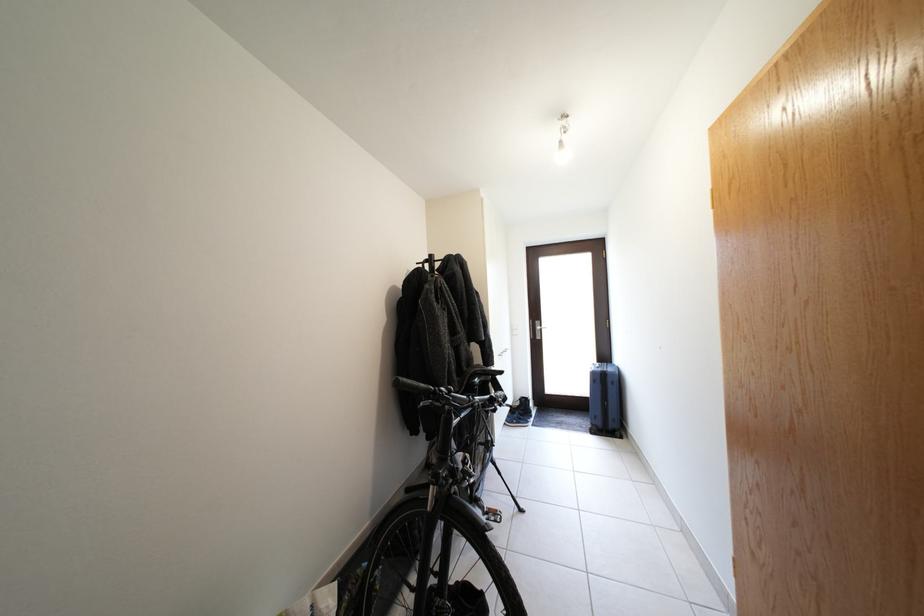
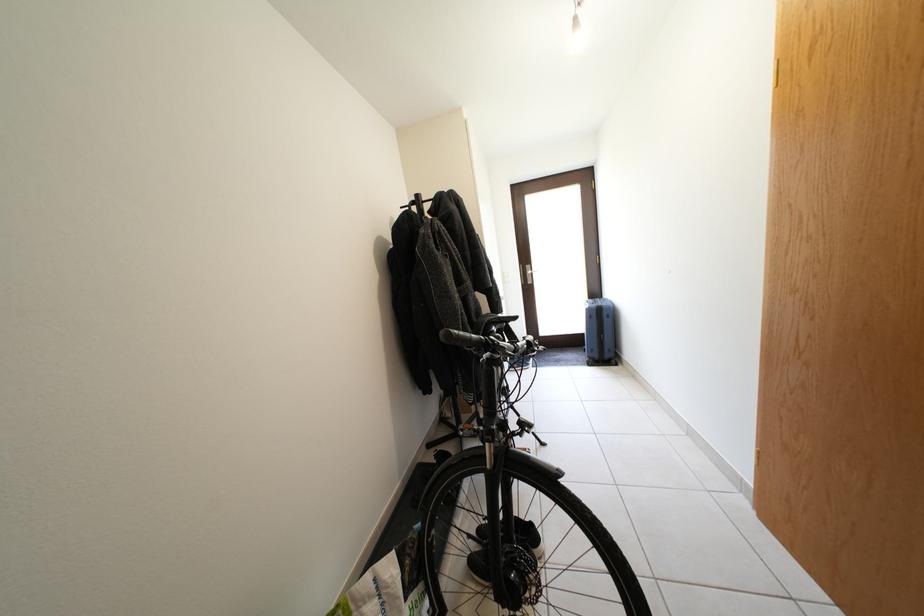
Question: Based on the continuous images, in which direction is the camera rotating? Reply with the corresponding letter.

Choices:
 (A) Left
 (B) Right
 (C) Up
 (D) Down

Answer: (D)